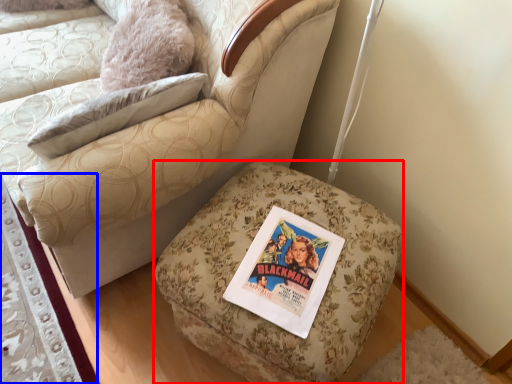
Question: Which object appears closest to the camera in this image, furniture (highlighted by a red box) or mat (highlighted by a blue box)?

Choices:
 (A) furniture
 (B) mat

Answer: (A)